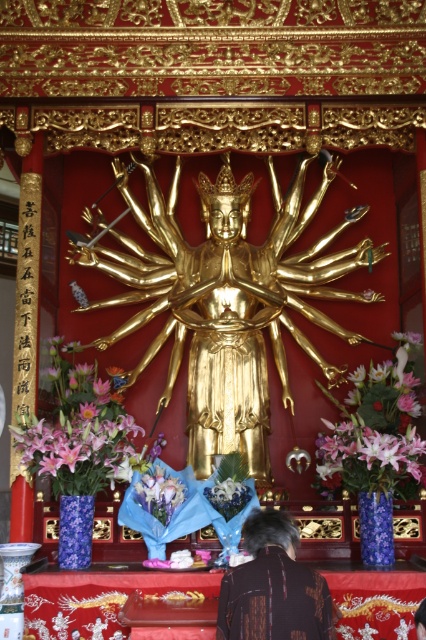
Is gold polished statue at center positioned at the back of pink silk flowers at center?

Yes.

Can you confirm if gold polished statue at center is positioned to the left of pink silk flowers at center?

Indeed, gold polished statue at center is positioned on the left side of pink silk flowers at center.

Locate an element on the screen. Image resolution: width=426 pixels, height=640 pixels. gold polished statue at center is located at coordinates (229, 301).

Find the location of a particular element. Image resolution: width=426 pixels, height=640 pixels. gold polished statue at center is located at coordinates (229, 301).

Who is positioned more to the left, pastel purple bouquet at center or silky blue bouquet at lower center?

From the viewer's perspective, pastel purple bouquet at center appears more on the left side.

At what (x,y) coordinates should I click in order to perform the action: click on pastel purple bouquet at center. Please return your answer as a coordinate pair (x, y). Image resolution: width=426 pixels, height=640 pixels. Looking at the image, I should click on (160, 492).

What do you see at coordinates (160, 492) in the screenshot? I see `pastel purple bouquet at center` at bounding box center [160, 492].

You are a GUI agent. You are given a task and a screenshot of the screen. Output one action in this format:
    pyautogui.click(x=<x>, y=<y>)
    Task: Click on the pastel purple bouquet at center
    
    Given the screenshot: What is the action you would take?
    pyautogui.click(x=160, y=492)

Is gold polished statue at center positioned before silky blue bouquet at lower center?

No, it is not.

Between point (291, 285) and point (238, 502), which one is positioned in front?

Positioned in front is point (238, 502).

Image resolution: width=426 pixels, height=640 pixels. I want to click on gold polished statue at center, so click(229, 301).